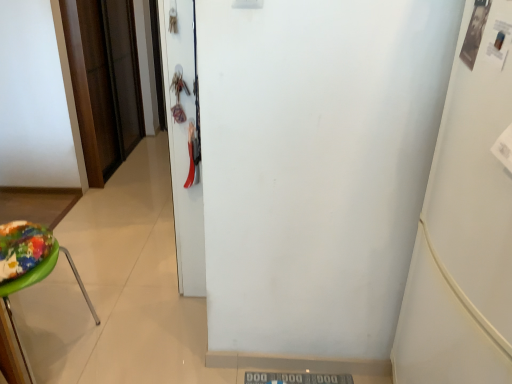
Question: Could you tell me if white matte refrigerator at right is turned towards brown wood door at left, marked as the first door in a left-to-right arrangement?

Choices:
 (A) no
 (B) yes

Answer: (A)

Question: Is white matte refrigerator at right beside brown wood door at left, acting as the second door starting from the front?

Choices:
 (A) yes
 (B) no

Answer: (B)

Question: Is white matte refrigerator at right to the left of brown wood door at left, which appears as the 1th door when viewed from the back, from the viewer's perspective?

Choices:
 (A) no
 (B) yes

Answer: (A)

Question: Could brown wood door at left, acting as the second door starting from the front, be considered to be inside white matte refrigerator at right?

Choices:
 (A) yes
 (B) no

Answer: (B)

Question: Is white matte refrigerator at right smaller than brown wood door at left, which is the second door in right-to-left order?

Choices:
 (A) yes
 (B) no

Answer: (B)

Question: Considering the positions of green plastic stool at left and white matte refrigerator at right in the image, is green plastic stool at left bigger or smaller than white matte refrigerator at right?

Choices:
 (A) big
 (B) small

Answer: (B)

Question: In terms of height, does green plastic stool at left look taller or shorter compared to white matte refrigerator at right?

Choices:
 (A) tall
 (B) short

Answer: (B)

Question: From the image's perspective, relative to white matte refrigerator at right, is green plastic stool at left above or below?

Choices:
 (A) below
 (B) above

Answer: (B)

Question: In terms of width, does green plastic stool at left look wider or thinner when compared to white matte refrigerator at right?

Choices:
 (A) wide
 (B) thin

Answer: (B)

Question: Is white matte refrigerator at right wider or thinner than brown wood door at left, which is the second door in right-to-left order?

Choices:
 (A) wide
 (B) thin

Answer: (A)

Question: From the image's perspective, relative to brown wood door at left, which appears as the 1th door when viewed from the back, is white matte refrigerator at right above or below?

Choices:
 (A) below
 (B) above

Answer: (A)

Question: From their relative heights in the image, would you say white matte refrigerator at right is taller or shorter than brown wood door at left, marked as the first door in a left-to-right arrangement?

Choices:
 (A) tall
 (B) short

Answer: (A)

Question: Does point (498, 82) appear closer or farther from the camera than point (106, 77)?

Choices:
 (A) closer
 (B) farther

Answer: (A)

Question: In terms of width, does brown wood door at left, which appears as the 1th door when viewed from the back, look wider or thinner when compared to green plastic stool at left?

Choices:
 (A) thin
 (B) wide

Answer: (A)

Question: Is brown wood door at left, which appears as the 1th door when viewed from the back, in front of or behind green plastic stool at left in the image?

Choices:
 (A) behind
 (B) front

Answer: (A)